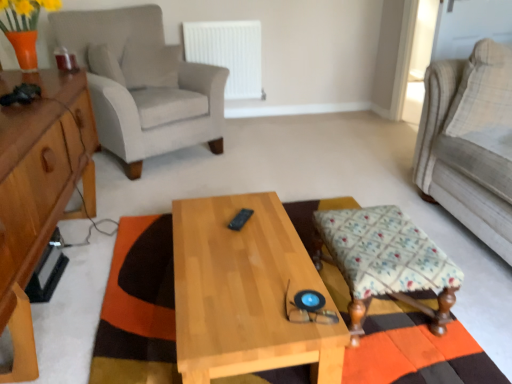
What is the approximate height of light brown wood cabinet at left?

The height of light brown wood cabinet at left is 72.72 centimeters.

Where is `light brown wood cabinet at left`? This screenshot has height=384, width=512. light brown wood cabinet at left is located at coordinates (39, 190).

Describe the element at coordinates (470, 142) in the screenshot. I see `light beige fabric couch at right` at that location.

This screenshot has width=512, height=384. What do you see at coordinates (138, 307) in the screenshot?
I see `orange and brown woven mat at center` at bounding box center [138, 307].

Consider the image. In order to face light wood/texture coffee table at center, should I rotate leftwards or rightwards?

Rotate your view left by about 1.865°.

Image resolution: width=512 pixels, height=384 pixels. Describe the element at coordinates (228, 53) in the screenshot. I see `white plastic radiator at upper center` at that location.

The width and height of the screenshot is (512, 384). Describe the element at coordinates (143, 84) in the screenshot. I see `light gray fabric armchair at left` at that location.

Where is `light brown wood cabinet at left`? Image resolution: width=512 pixels, height=384 pixels. light brown wood cabinet at left is located at coordinates (39, 190).

Who is more distant, floral fabric stool at lower right or light gray fabric armchair at left?

light gray fabric armchair at left is more distant.

From the image's perspective, is floral fabric stool at lower right located beneath light gray fabric armchair at left?

Indeed, from the image's perspective, floral fabric stool at lower right is shown beneath light gray fabric armchair at left.

From a real-world perspective, relative to light gray fabric armchair at left, is floral fabric stool at lower right vertically above or below?

In terms of real-world spatial position, floral fabric stool at lower right is below light gray fabric armchair at left.

Is floral fabric stool at lower right situated inside light gray fabric armchair at left or outside?

floral fabric stool at lower right is not enclosed by light gray fabric armchair at left.

Which point is more forward, (246, 34) or (442, 174)?

Positioned in front is point (442, 174).

Considering the sizes of objects white plastic radiator at upper center and light beige fabric couch at right in the image provided, who is shorter, white plastic radiator at upper center or light beige fabric couch at right?

With less height is white plastic radiator at upper center.

Could you tell me if white plastic radiator at upper center is facing light beige fabric couch at right?

No, white plastic radiator at upper center is not aimed at light beige fabric couch at right.

Is there a large distance between white plastic radiator at upper center and light beige fabric couch at right?

white plastic radiator at upper center is far away from light beige fabric couch at right.

Does light gray fabric armchair at left appear on the right side of light wood/texture coffee table at center?

In fact, light gray fabric armchair at left is to the left of light wood/texture coffee table at center.

From the picture: From the image's perspective, is light gray fabric armchair at left above or below light wood/texture coffee table at center?

light gray fabric armchair at left is above light wood/texture coffee table at center.

Are light gray fabric armchair at left and light wood/texture coffee table at center located far from each other?

light gray fabric armchair at left is positioned a significant distance from light wood/texture coffee table at center.

Looking at this image, from a real-world perspective, between white plastic radiator at upper center and floral fabric stool at lower right, who is vertically lower?

In real-world perspective, floral fabric stool at lower right is lower.

Measure the distance between white plastic radiator at upper center and floral fabric stool at lower right.

white plastic radiator at upper center and floral fabric stool at lower right are 2.28 meters apart.

Between point (251, 63) and point (399, 280), which one is positioned behind?

The point (251, 63) is farther from the camera.

Consider the image. Does white plastic radiator at upper center come in front of floral fabric stool at lower right?

No.

Is point (106, 363) more distant than point (49, 116)?

No, (106, 363) is in front of (49, 116).

Is orange and brown woven mat at center next to light brown wood cabinet at left and touching it?

orange and brown woven mat at center and light brown wood cabinet at left are clearly separated.

What's the angular difference between orange and brown woven mat at center and light brown wood cabinet at left's facing directions?

1.15 degrees separate the facing orientations of orange and brown woven mat at center and light brown wood cabinet at left.

Which of these two, orange and brown woven mat at center or light brown wood cabinet at left, is bigger?

With larger size is light brown wood cabinet at left.

Considering the sizes of objects fluffy beige pillow at right and light gray fabric armchair at left in the image provided, who is taller, fluffy beige pillow at right or light gray fabric armchair at left?

light gray fabric armchair at left is taller.

Is fluffy beige pillow at right further to camera compared to light gray fabric armchair at left?

No, the depth of fluffy beige pillow at right is less than that of light gray fabric armchair at left.

Who is bigger, fluffy beige pillow at right or light gray fabric armchair at left?

With larger size is light gray fabric armchair at left.

From a real-world perspective, which is physically above, fluffy beige pillow at right or light gray fabric armchair at left?

fluffy beige pillow at right.

From a real-world perspective, is light brown wood cabinet at left physically below orange and brown woven mat at center?

No, from a real-world perspective, light brown wood cabinet at left is not under orange and brown woven mat at center.

From the image's perspective, is light brown wood cabinet at left positioned above or below orange and brown woven mat at center?

Clearly, from the image's perspective, light brown wood cabinet at left is above orange and brown woven mat at center.

Is point (18, 364) closer or farther from the camera than point (101, 314)?

Point (18, 364) is closer to the camera than point (101, 314).

Consider the image. How many degrees apart are the facing directions of light brown wood cabinet at left and orange and brown woven mat at center?

light brown wood cabinet at left and orange and brown woven mat at center are facing 1.15 degrees away from each other.

Locate an element on the screen. chair above the floral fabric stool at lower right (from the image's perspective) is located at coordinates click(143, 84).

Where is `studio couch positioned vertically above the white plastic radiator at upper center (from a real-world perspective)`? The height and width of the screenshot is (384, 512). studio couch positioned vertically above the white plastic radiator at upper center (from a real-world perspective) is located at coordinates (470, 142).

From the image, which object appears to be farther from light beige fabric couch at right, light gray fabric armchair at left or fluffy beige pillow at right?

light gray fabric armchair at left.

Considering their positions, is white plastic radiator at upper center positioned further to light gray fabric armchair at left than light beige fabric couch at right?

light beige fabric couch at right is positioned further to the anchor light gray fabric armchair at left.

Based on the photo, looking at the image, which one is located further to floral fabric stool at lower right, light brown wood cabinet at left or light wood/texture coffee table at center?

light brown wood cabinet at left lies further to floral fabric stool at lower right than the other object.

Which object lies further to the anchor point light gray fabric armchair at left, light beige fabric couch at right or fluffy beige pillow at right?

Based on the image, fluffy beige pillow at right appears to be further to light gray fabric armchair at left.

Estimate the real-world distances between objects in this image. Which object is closer to orange and brown woven mat at center, light gray fabric armchair at left or white plastic radiator at upper center?

light gray fabric armchair at left lies closer to orange and brown woven mat at center than the other object.

Based on their spatial positions, is orange and brown woven mat at center or white plastic radiator at upper center further from floral fabric stool at lower right?

Based on the image, white plastic radiator at upper center appears to be further to floral fabric stool at lower right.

Consider the image. Estimate the real-world distances between objects in this image. Which object is closer to floral fabric stool at lower right, light wood/texture coffee table at center or fluffy beige pillow at right?

The object closer to floral fabric stool at lower right is light wood/texture coffee table at center.

Estimate the real-world distances between objects in this image. Which object is further from light brown wood cabinet at left, orange and brown woven mat at center or fluffy beige pillow at right?

fluffy beige pillow at right.

Find the location of a particular element. stool located between light brown wood cabinet at left and fluffy beige pillow at right in the left-right direction is located at coordinates (385, 261).

Image resolution: width=512 pixels, height=384 pixels. What are the coordinates of `mat between light gray fabric armchair at left and light beige fabric couch at right` in the screenshot? It's located at (138, 307).

Locate an element on the screen. stool between light gray fabric armchair at left and light beige fabric couch at right from left to right is located at coordinates (385, 261).

Locate an element on the screen. chair located between light brown wood cabinet at left and floral fabric stool at lower right in the left-right direction is located at coordinates (143, 84).